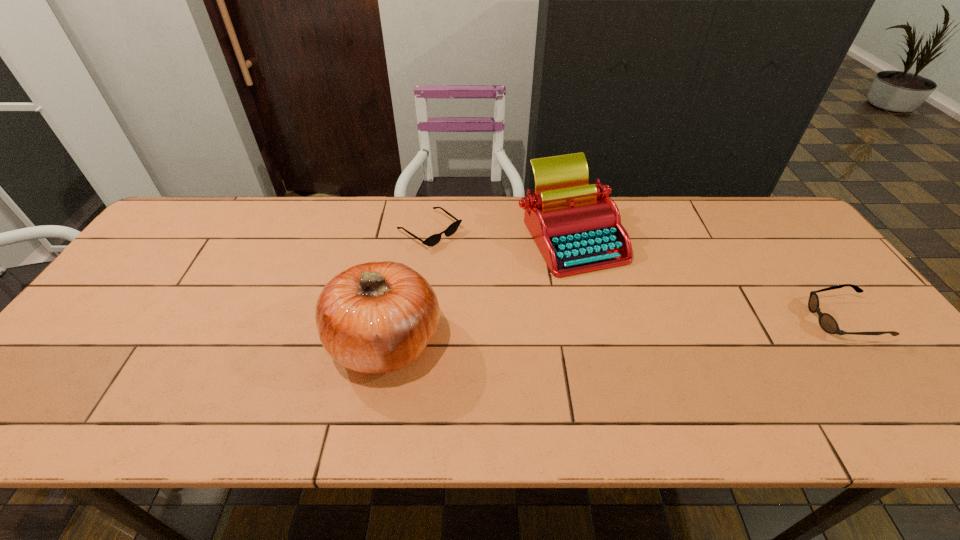
Where is `object situated at the right edge`? This screenshot has width=960, height=540. object situated at the right edge is located at coordinates (827, 322).

Find the location of a particular element. vacant space at the far edge of the desktop is located at coordinates (330, 203).

Identify the location of blank space at the near edge of the desktop. (577, 377).

Find the location of `vacant area at the right edge of the desktop`. vacant area at the right edge of the desktop is located at coordinates (780, 246).

Where is `free space at the near left corner of the desktop`? free space at the near left corner of the desktop is located at coordinates (94, 376).

Identify the location of vacant region at the far right corner of the desktop. (758, 238).

You are a GUI agent. You are given a task and a screenshot of the screen. Output one action in this format:
    pyautogui.click(x=<x>, y=<y>)
    Task: Click on the free space between the tallest object and the rightmost object
    
    Given the screenshot: What is the action you would take?
    pyautogui.click(x=614, y=329)

The image size is (960, 540). I want to click on free space between the pumpkin and the nearer sunglasses, so click(614, 329).

This screenshot has height=540, width=960. Find the location of `free space between the third shortest object and the taller sunglasses`. free space between the third shortest object and the taller sunglasses is located at coordinates (707, 277).

I want to click on empty space that is in between the typewriter and the left sunglasses, so click(x=500, y=233).